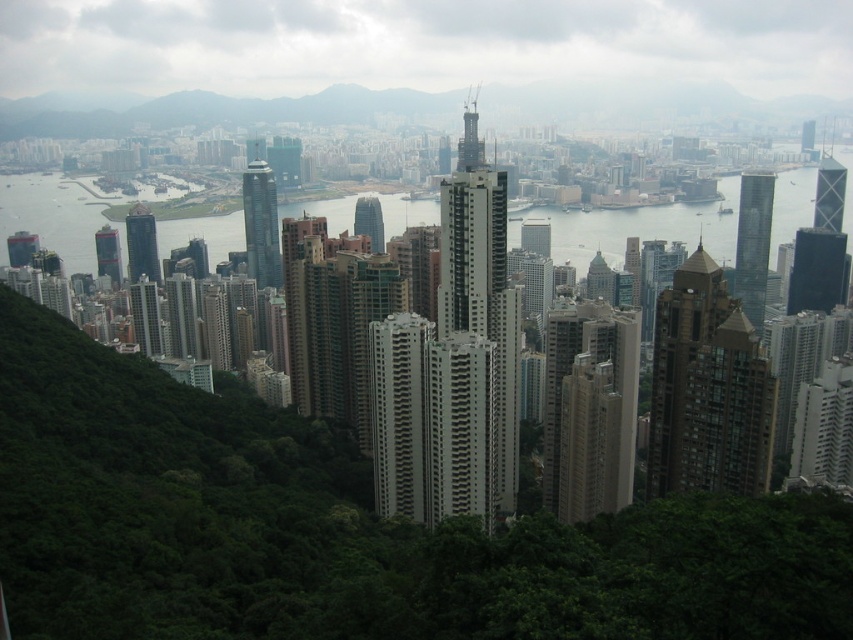
Is black glass skyscraper at right shorter than glassy skyscraper at center?

In fact, black glass skyscraper at right may be taller than glassy skyscraper at center.

Consider the image. Who is positioned more to the left, black glass skyscraper at right or glassy skyscraper at center?

glassy skyscraper at center

Where is `black glass skyscraper at right`? black glass skyscraper at right is located at coordinates (817, 269).

What are the coordinates of `black glass skyscraper at right` in the screenshot? It's located at (817, 269).

Does black glass skyscraper at right have a lesser width compared to matte glass skyscraper at center?

No, black glass skyscraper at right is not thinner than matte glass skyscraper at center.

Is black glass skyscraper at right smaller than matte glass skyscraper at center?

No, black glass skyscraper at right is not smaller than matte glass skyscraper at center.

Between point (840, 285) and point (102, 268), which one is positioned in front?

Point (102, 268) is in front.

At what (x,y) coordinates should I click in order to perform the action: click on black glass skyscraper at right. Please return your answer as a coordinate pair (x, y). The width and height of the screenshot is (853, 640). Looking at the image, I should click on (817, 269).

Does brown glassy building at center appear on the right side of metallic glass skyscraper at upper right?

Incorrect, brown glassy building at center is not on the right side of metallic glass skyscraper at upper right.

Who is more forward, (654, 493) or (828, 189)?

Point (654, 493)

Where is `brown glassy building at center`? The image size is (853, 640). brown glassy building at center is located at coordinates (706, 388).